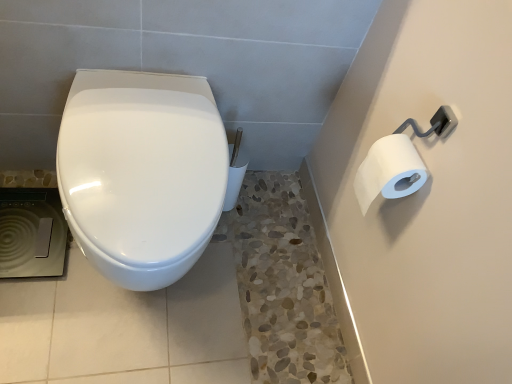
Where is `white matte toilet paper at upper right`? This screenshot has width=512, height=384. white matte toilet paper at upper right is located at coordinates (389, 171).

What do you see at coordinates (389, 171) in the screenshot? I see `white matte toilet paper at upper right` at bounding box center [389, 171].

Locate an element on the screen. glossy ceramic toilet at center is located at coordinates (141, 173).

In order to face glossy ceramic toilet at center, should I rotate leftwards or rightwards?

Rotate your view left by about 14.311°.

This screenshot has width=512, height=384. What do you see at coordinates (141, 173) in the screenshot? I see `glossy ceramic toilet at center` at bounding box center [141, 173].

This screenshot has height=384, width=512. What are the coordinates of `white matte toilet paper at upper right` in the screenshot? It's located at (389, 171).

Between glossy ceramic toilet at center and white matte toilet paper at upper right, which one appears on the left side from the viewer's perspective?

Result: glossy ceramic toilet at center.

In the scene shown: Is glossy ceramic toilet at center further to the viewer compared to white matte toilet paper at upper right?

No, the depth of glossy ceramic toilet at center is less than that of white matte toilet paper at upper right.

Which point is more forward, [187,204] or [369,170]?

Positioned in front is point [187,204].

From the image's perspective, is glossy ceramic toilet at center below white matte toilet paper at upper right?

Correct, glossy ceramic toilet at center appears lower than white matte toilet paper at upper right in the image.

From a real-world perspective, which is physically above, glossy ceramic toilet at center or white matte toilet paper at upper right?

white matte toilet paper at upper right is physically above.

From the picture: Is glossy ceramic toilet at center wider than white matte toilet paper at upper right?

Yes, glossy ceramic toilet at center is wider than white matte toilet paper at upper right.

Considering the sizes of objects glossy ceramic toilet at center and white matte toilet paper at upper right in the image provided, who is shorter, glossy ceramic toilet at center or white matte toilet paper at upper right?

white matte toilet paper at upper right is shorter.

Is glossy ceramic toilet at center smaller than white matte toilet paper at upper right?

No.

Can white matte toilet paper at upper right be found inside glossy ceramic toilet at center?

Definitely not — white matte toilet paper at upper right is not inside glossy ceramic toilet at center.

Is glossy ceramic toilet at center beside white matte toilet paper at upper right?

No, glossy ceramic toilet at center is not in contact with white matte toilet paper at upper right.

Is glossy ceramic toilet at center turned away from white matte toilet paper at upper right?

glossy ceramic toilet at center is not turned away from white matte toilet paper at upper right.

How different are the orientations of glossy ceramic toilet at center and white matte toilet paper at upper right in degrees?

89.9 degrees separate the facing orientations of glossy ceramic toilet at center and white matte toilet paper at upper right.

Identify the location of toilet that is under the white matte toilet paper at upper right (from a real-world perspective). click(141, 173).

Is white matte toilet paper at upper right to the left or to the right of glossy ceramic toilet at center in the image?

Clearly, white matte toilet paper at upper right is on the right of glossy ceramic toilet at center in the image.

Is white matte toilet paper at upper right closer to the viewer compared to glossy ceramic toilet at center?

No, the depth of white matte toilet paper at upper right is greater than that of glossy ceramic toilet at center.

Considering the positions of point (376, 169) and point (180, 146), is point (376, 169) closer or farther from the camera than point (180, 146)?

Clearly, point (376, 169) is closer to the camera than point (180, 146).

From the image's perspective, which is above, white matte toilet paper at upper right or glossy ceramic toilet at center?

white matte toilet paper at upper right, from the image's perspective.

From a real-world perspective, which is physically below, white matte toilet paper at upper right or glossy ceramic toilet at center?

glossy ceramic toilet at center is physically lower.

Does white matte toilet paper at upper right have a greater width compared to glossy ceramic toilet at center?

No.

From their relative heights in the image, would you say white matte toilet paper at upper right is taller or shorter than glossy ceramic toilet at center?

white matte toilet paper at upper right is shorter than glossy ceramic toilet at center.

Which of these two, white matte toilet paper at upper right or glossy ceramic toilet at center, is smaller?

white matte toilet paper at upper right is smaller.

Is white matte toilet paper at upper right positioned beyond the bounds of glossy ceramic toilet at center?

Yes, white matte toilet paper at upper right is not within glossy ceramic toilet at center.

Is white matte toilet paper at upper right in contact with glossy ceramic toilet at center?

No, white matte toilet paper at upper right is not next to glossy ceramic toilet at center.

Is white matte toilet paper at upper right facing away from glossy ceramic toilet at center?

No, white matte toilet paper at upper right is not facing the opposite direction of glossy ceramic toilet at center.

How different are the orientations of white matte toilet paper at upper right and glossy ceramic toilet at center in degrees?

89.9 degrees separate the facing orientations of white matte toilet paper at upper right and glossy ceramic toilet at center.

How distant is white matte toilet paper at upper right from glossy ceramic toilet at center?

19.26 inches.

Where is `toilet to the left of white matte toilet paper at upper right`? This screenshot has width=512, height=384. toilet to the left of white matte toilet paper at upper right is located at coordinates (141, 173).

The height and width of the screenshot is (384, 512). What are the coordinates of `toilet paper on the right of glossy ceramic toilet at center` in the screenshot? It's located at (389, 171).

Where is `toilet paper lying above the glossy ceramic toilet at center (from the image's perspective)`? toilet paper lying above the glossy ceramic toilet at center (from the image's perspective) is located at coordinates (389, 171).